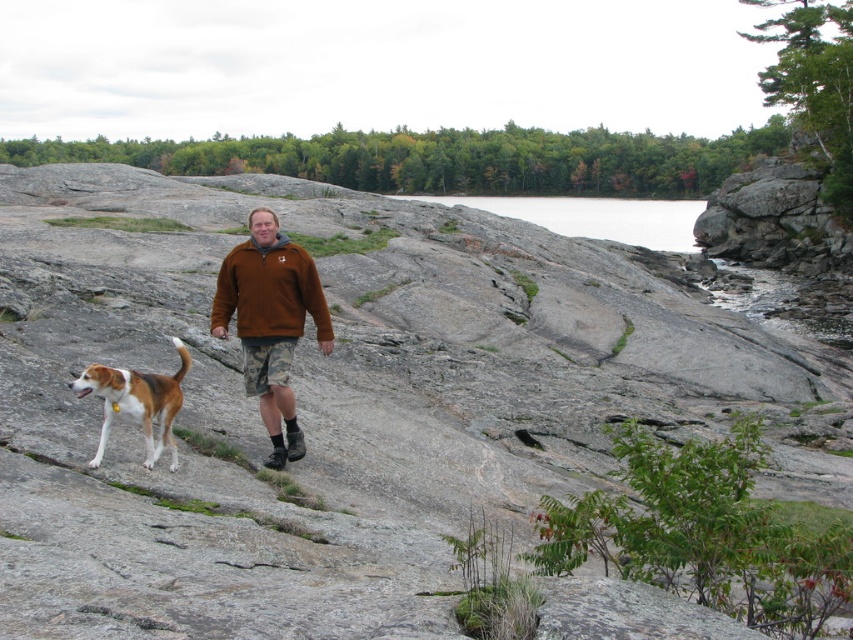
Measure the distance between point (293,253) and camera.

Point (293,253) is 32.93 feet from camera.

Is brown fleece jacket at center below tri-color fur dog at lower left?

Incorrect, brown fleece jacket at center is not positioned below tri-color fur dog at lower left.

The height and width of the screenshot is (640, 853). Describe the element at coordinates (270, 321) in the screenshot. I see `brown fleece jacket at center` at that location.

Where is `brown fleece jacket at center`? brown fleece jacket at center is located at coordinates (270, 321).

Can you confirm if brown fleece jacket at center is thinner than transparent water at upper center?

Yes.

Between point (229, 273) and point (547, 211), which one is positioned behind?

Point (547, 211)

Where is `brown fleece jacket at center`? The image size is (853, 640). brown fleece jacket at center is located at coordinates (270, 321).

Is transparent water at upper center positioned before tri-color fur dog at lower left?

No, transparent water at upper center is behind tri-color fur dog at lower left.

Which of these two, transparent water at upper center or tri-color fur dog at lower left, stands taller?

transparent water at upper center is taller.

Who is more forward, (573, 200) or (166, 440)?

Point (166, 440)

Image resolution: width=853 pixels, height=640 pixels. I want to click on transparent water at upper center, so click(x=596, y=216).